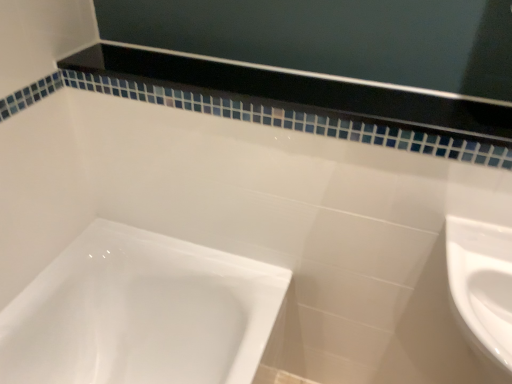
Question: Is black glossy balustrade at upper center placed right next to white glossy sink at lower right?

Choices:
 (A) no
 (B) yes

Answer: (A)

Question: Considering the relative sizes of black glossy balustrade at upper center and white glossy sink at lower right in the image provided, is black glossy balustrade at upper center bigger than white glossy sink at lower right?

Choices:
 (A) no
 (B) yes

Answer: (A)

Question: Is black glossy balustrade at upper center not near white glossy sink at lower right?

Choices:
 (A) yes
 (B) no

Answer: (B)

Question: Does black glossy balustrade at upper center lie behind white glossy sink at lower right?

Choices:
 (A) yes
 (B) no

Answer: (A)

Question: Can you confirm if black glossy balustrade at upper center is smaller than white glossy sink at lower right?

Choices:
 (A) yes
 (B) no

Answer: (A)

Question: Does black glossy balustrade at upper center have a greater width compared to white glossy sink at lower right?

Choices:
 (A) no
 (B) yes

Answer: (A)

Question: Is white glossy sink at lower right turned away from black glossy balustrade at upper center?

Choices:
 (A) no
 (B) yes

Answer: (A)

Question: Does white glossy sink at lower right have a smaller size compared to black glossy balustrade at upper center?

Choices:
 (A) yes
 (B) no

Answer: (B)

Question: Is white glossy sink at lower right closer to camera compared to black glossy balustrade at upper center?

Choices:
 (A) no
 (B) yes

Answer: (B)

Question: Can you confirm if white glossy sink at lower right is shorter than black glossy balustrade at upper center?

Choices:
 (A) yes
 (B) no

Answer: (B)

Question: Would you consider white glossy sink at lower right to be distant from black glossy balustrade at upper center?

Choices:
 (A) yes
 (B) no

Answer: (B)

Question: Does white glossy sink at lower right turn towards black glossy balustrade at upper center?

Choices:
 (A) yes
 (B) no

Answer: (B)

Question: From a real-world perspective, is white glossy sink at lower right above or below black glossy balustrade at upper center?

Choices:
 (A) above
 (B) below

Answer: (B)